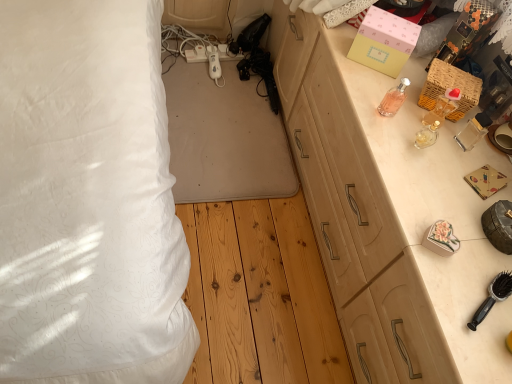
You are a GUI agent. You are given a task and a screenshot of the screen. Output one action in this format:
    pyautogui.click(x=<x>, y=<y>)
    Task: Click on the vacant space to the right of pink glass bottle at upper right, positioned as the 3th perfume in right-to-left order
    This screenshot has width=512, height=384.
    Given the screenshot: What is the action you would take?
    pyautogui.click(x=425, y=128)